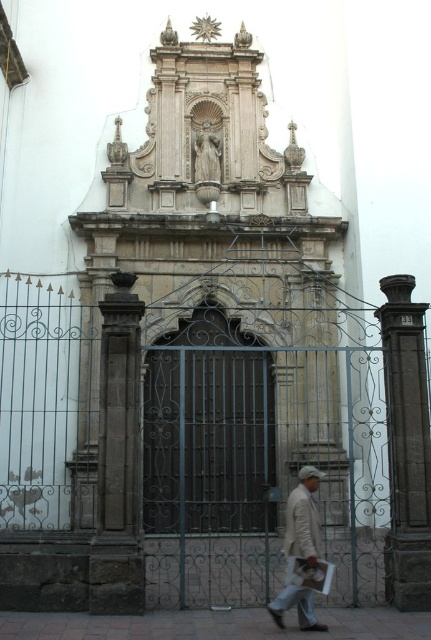
You are a visitor approaching the entrance of the historic building. You see the dark wrought iron gate at center and the white matte jacket at lower center. Which object is closer to you as you approach the entrance?

The dark wrought iron gate at center is closer to you since the white matte jacket at lower center is behind it.

You are standing at the entrance of the historic building and want to take a photo of the point marked at coordinates (249, 509). If your camera has a maximum focus range of 60 meters, will it be able to focus on that point?

The point at coordinates (249, 509) is 59.02 meters away from the viewer. Since the camera can focus up to 60 meters, it will be able to focus on the point.

You are standing in front of the historic building entrance. You see the dark wrought iron gate at center and the white matte jacket at lower center. Which object is positioned to the right side?

The white matte jacket at lower center is positioned to the right side of the dark wrought iron gate at center.